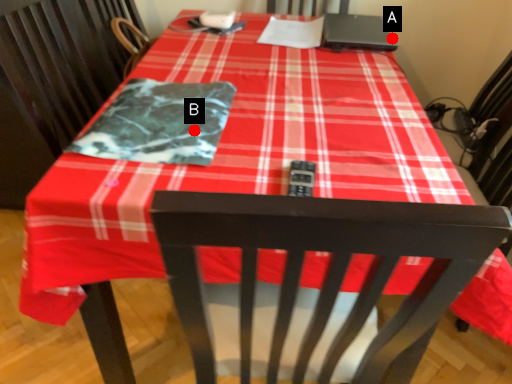
Question: Two points are circled on the image, labeled by A and B beside each circle. Among these points, which one is nearest to the camera?

Choices:
 (A) A is closer
 (B) B is closer

Answer: (B)